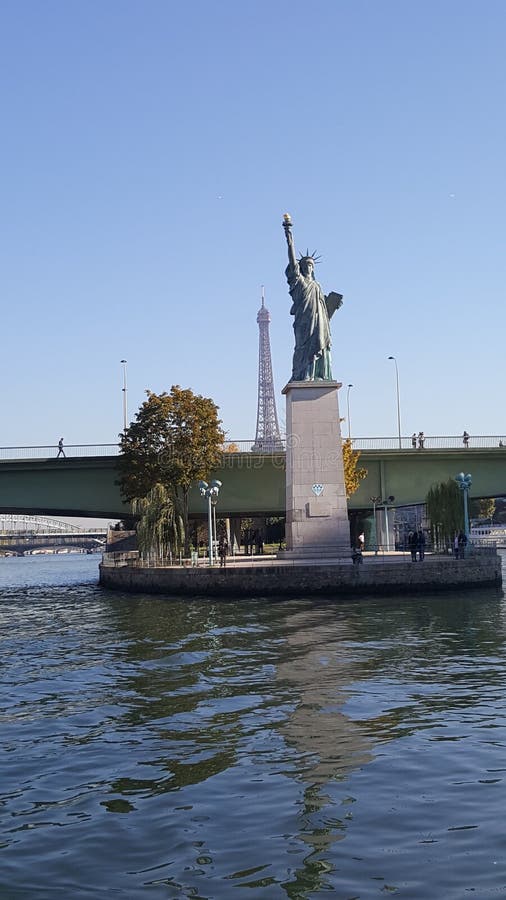
The image size is (506, 900). Identify the location of plinth. (314, 445).